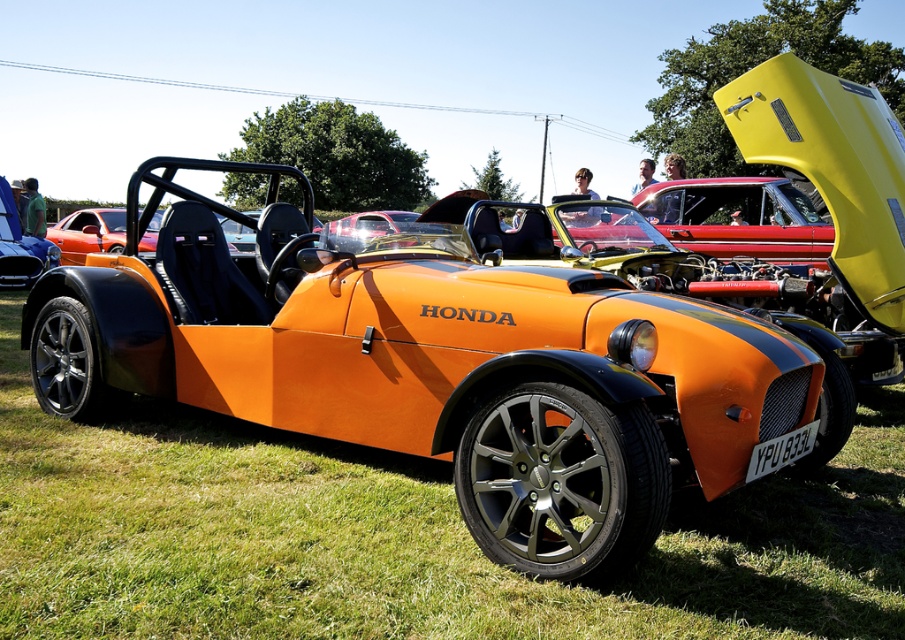
Which is more to the right, shiny red car at center or metallic silver car at center?

shiny red car at center is more to the right.

Does shiny red car at center have a lesser width compared to metallic silver car at center?

Incorrect, shiny red car at center's width is not less than metallic silver car at center's.

Where is `shiny red car at center`? shiny red car at center is located at coordinates (738, 218).

Locate an element on the screen. shiny red car at center is located at coordinates (738, 218).

Measure the distance between green grass at lower center and camera.

green grass at lower center and camera are 2.52 meters apart from each other.

Is green grass at lower center bigger than matte black car at center?

No.

What do you see at coordinates (399, 538) in the screenshot? The height and width of the screenshot is (640, 905). I see `green grass at lower center` at bounding box center [399, 538].

Image resolution: width=905 pixels, height=640 pixels. I want to click on green grass at lower center, so click(399, 538).

Does point (669, 241) come behind point (17, 189)?

No, it is in front of (17, 189).

Does shiny red car at center appear on the right side of matte black car at center?

Indeed, shiny red car at center is positioned on the right side of matte black car at center.

Between point (825, 236) and point (5, 285), which one is positioned in front?

Point (825, 236) is more forward.

Image resolution: width=905 pixels, height=640 pixels. In order to click on shiny red car at center in this screenshot , I will do `click(738, 218)`.